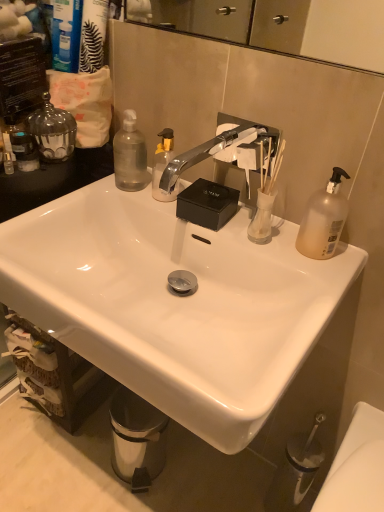
Find the location of a particular element. The width and height of the screenshot is (384, 512). free space in front of stainless steel trash can at lower left is located at coordinates [124, 498].